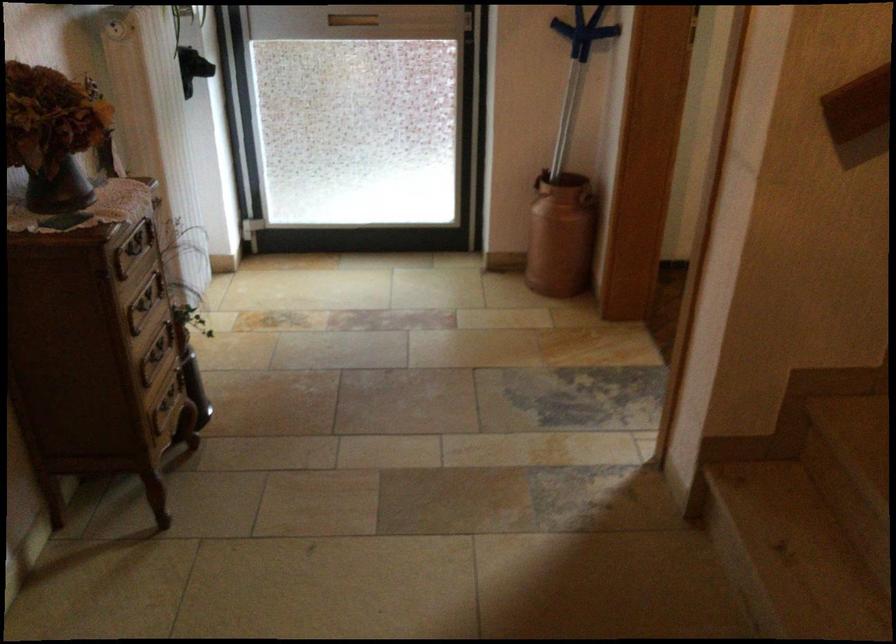
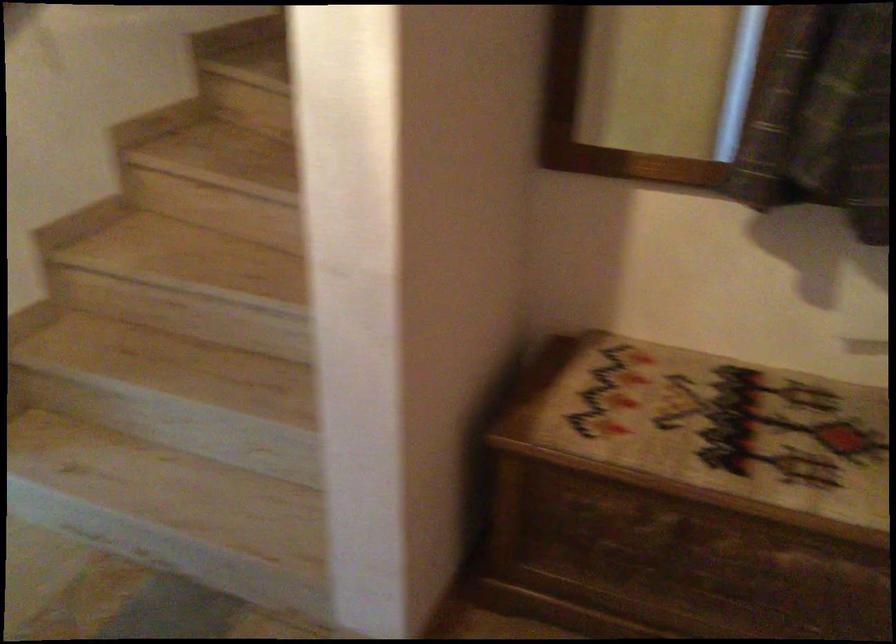
Question: The camera is either moving clockwise (left) or counter-clockwise (right) around the object. The first image is from the beginning of the video and the second image is from the end. Is the camera moving left or right when shooting the video?

Choices:
 (A) Left
 (B) Right

Answer: (A)